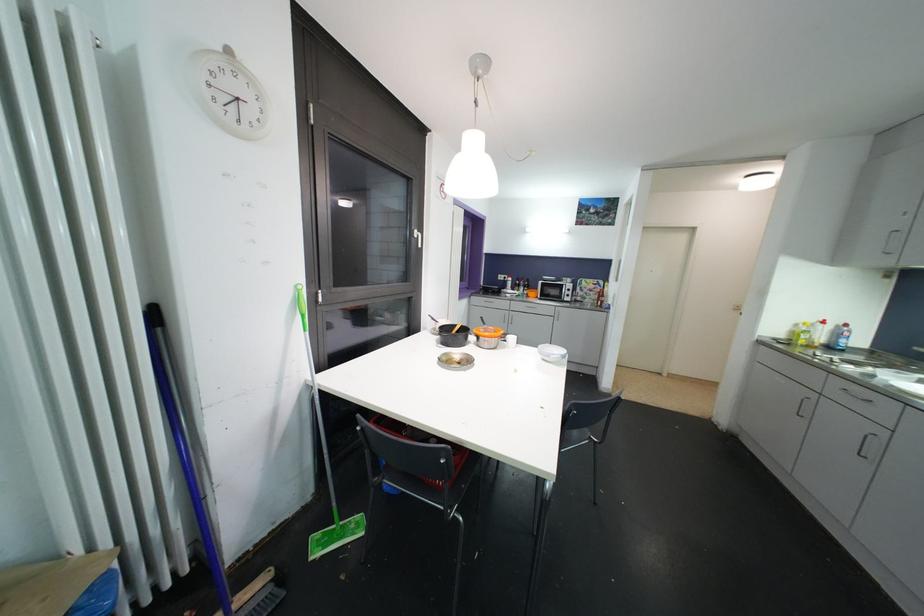
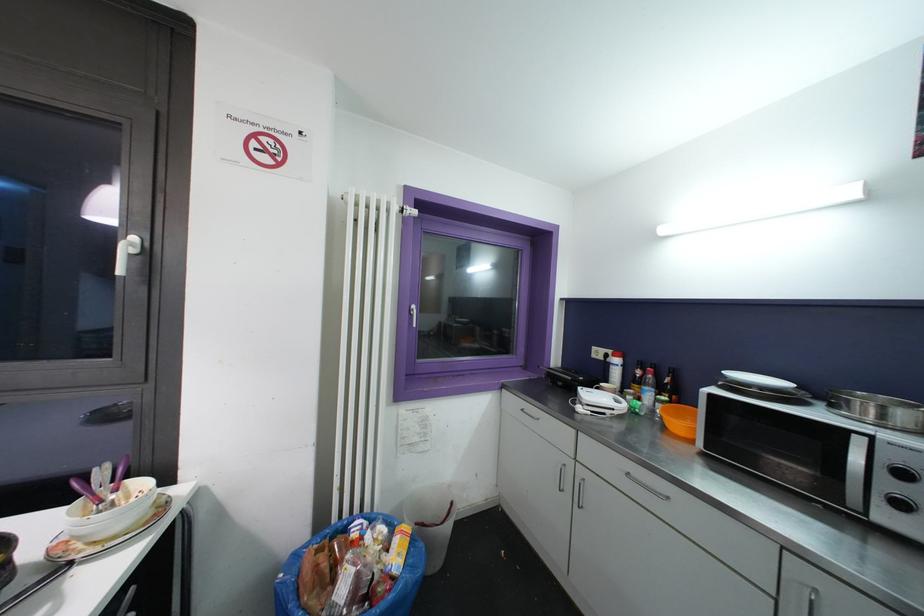
In the second image, find the point that corresponds to point 572,293 in the first image.

(906, 477)